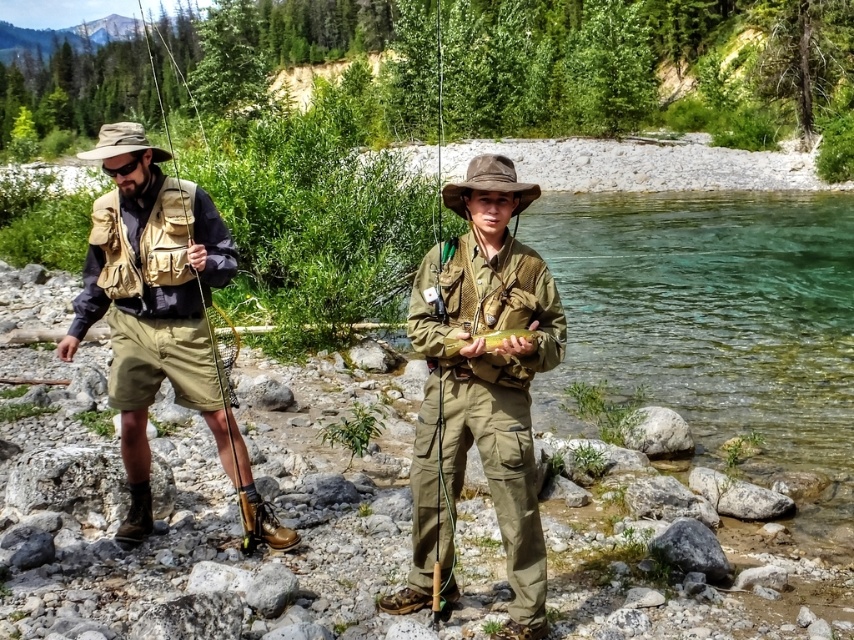
How far apart are matte khaki uniform at center and matte khaki shorts at left?

matte khaki uniform at center is 2.67 meters away from matte khaki shorts at left.

Can you confirm if matte khaki uniform at center is bigger than matte khaki shorts at left?

No, matte khaki uniform at center is not bigger than matte khaki shorts at left.

Who is more distant from viewer, (518,266) or (101,296)?

Point (101,296)

The image size is (854, 640). What are the coordinates of `matte khaki uniform at center` in the screenshot? It's located at (480, 392).

Can you confirm if matte khaki shorts at left is bigger than matte brown fishing pole at left?

No, matte khaki shorts at left is not bigger than matte brown fishing pole at left.

I want to click on matte khaki shorts at left, so click(159, 314).

Describe the element at coordinates (159, 314) in the screenshot. I see `matte khaki shorts at left` at that location.

Locate an element on the screen. This screenshot has width=854, height=640. matte khaki shorts at left is located at coordinates (159, 314).

Is matte khaki shorts at left positioned behind shiny yellow fish at center?

Yes, matte khaki shorts at left is behind shiny yellow fish at center.

Is point (199, 292) farther from camera compared to point (489, 337)?

Yes, it is behind point (489, 337).

Find the location of a particular element. The image size is (854, 640). matte khaki shorts at left is located at coordinates (159, 314).